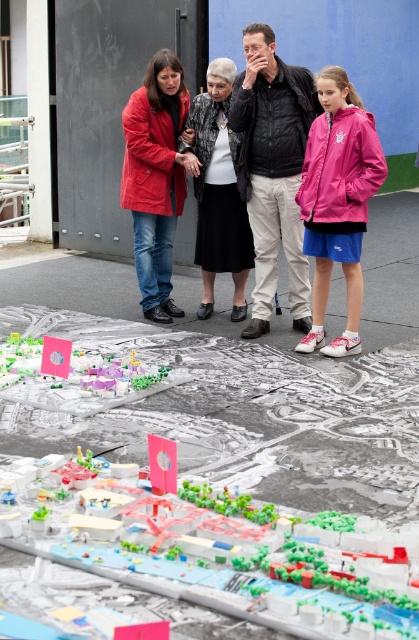
Question: Among these objects, which one is nearest to the camera?

Choices:
 (A) pink matte jacket at upper right
 (B) matte red jacket at center

Answer: (A)

Question: Among these points, which one is farthest from the camera?

Choices:
 (A) (302, 554)
 (B) (136, 230)
 (C) (216, 257)

Answer: (B)

Question: Which point is farther to the camera?

Choices:
 (A) (168, 125)
 (B) (331, 353)
 (C) (0, 532)

Answer: (A)

Question: Does matte black jacket at center appear on the right side of black matte skirt at center?

Choices:
 (A) yes
 (B) no

Answer: (A)

Question: Is black matte skirt at center closer to the viewer compared to pink plastic flag at upper left?

Choices:
 (A) yes
 (B) no

Answer: (B)

Question: Can you confirm if matte black jacket at center is positioned above matte red jacket at center?

Choices:
 (A) yes
 (B) no

Answer: (B)